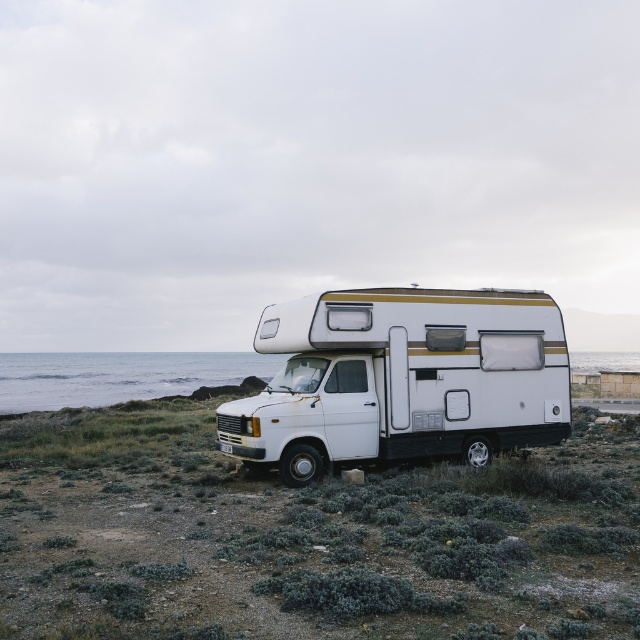
Question: Does white matte recreational vehicle at center appear on the right side of blue water at lower left?

Choices:
 (A) yes
 (B) no

Answer: (A)

Question: Is white matte recreational vehicle at center wider than blue water at lower left?

Choices:
 (A) no
 (B) yes

Answer: (A)

Question: Which object is farther from the camera taking this photo?

Choices:
 (A) blue water at lower left
 (B) white matte recreational vehicle at center

Answer: (A)

Question: Which point is farther from the camera taking this photo?

Choices:
 (A) (8, 364)
 (B) (516, 333)

Answer: (A)

Question: Can you confirm if white matte recreational vehicle at center is thinner than blue water at lower left?

Choices:
 (A) no
 (B) yes

Answer: (B)